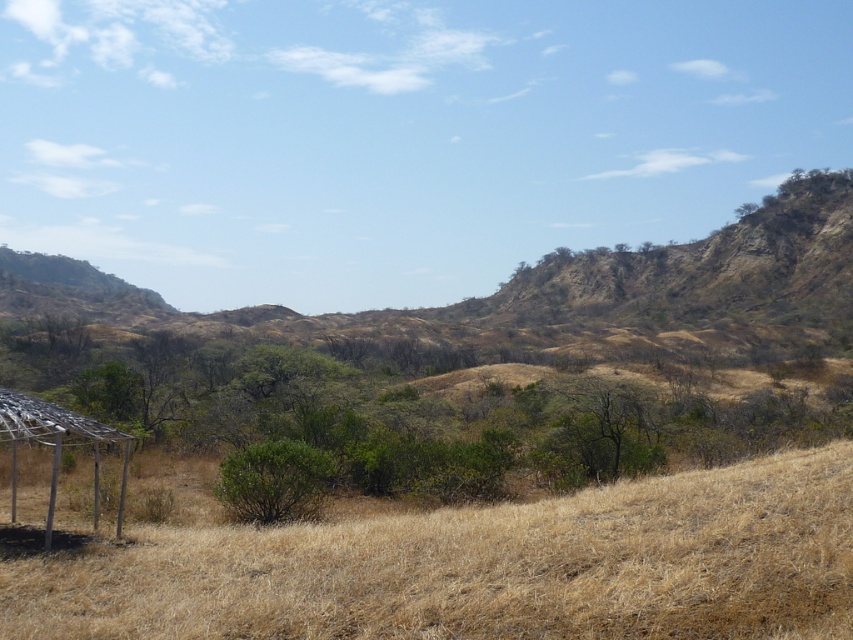
Question: Among these objects, which one is nearest to the camera?

Choices:
 (A) metallic silver gazebo at lower left
 (B) dry grass at lower center

Answer: (B)

Question: Is dry grass at lower center further to camera compared to metallic silver gazebo at lower left?

Choices:
 (A) no
 (B) yes

Answer: (A)

Question: In this image, where is dry grass at lower center located relative to metallic silver gazebo at lower left?

Choices:
 (A) above
 (B) below

Answer: (A)

Question: Which point is farther to the camera?

Choices:
 (A) dry grass at lower center
 (B) metallic silver gazebo at lower left

Answer: (B)

Question: Is dry grass at lower center bigger than metallic silver gazebo at lower left?

Choices:
 (A) no
 (B) yes

Answer: (A)